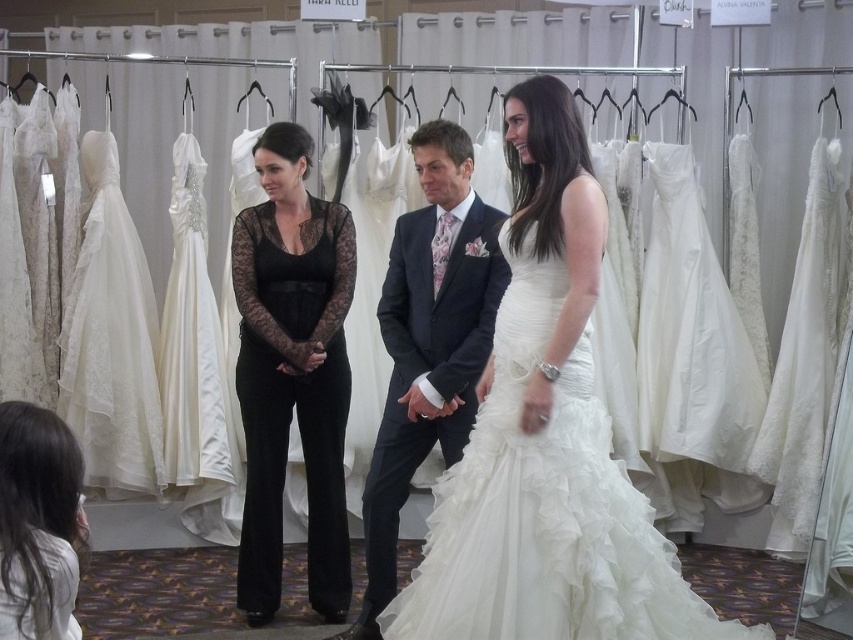
What are the coordinates of the white satin gown at center?

The white satin gown at center is located at coordinates point (547, 440).

In the bridal shop scene, you see a white satin gown at center and an ivory lace wedding dress at left. Which one is positioned more to the right side of the image?

The white satin gown at center is positioned more to the right side of the image than the ivory lace wedding dress at left.

You are a customer in the bridal shop and want to know which item is taller between the white satin gown at center and the smooth white blouse at lower left. Can you tell me?

The white satin gown at center is taller than the smooth white blouse at lower left.